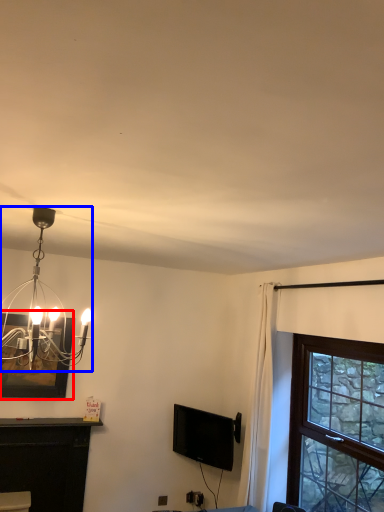
Question: Which object is further to the camera taking this photo, picture frame (highlighted by a red box) or lamp (highlighted by a blue box)?

Choices:
 (A) picture frame
 (B) lamp

Answer: (A)